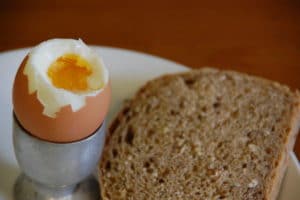
Where is `plate`? This screenshot has height=200, width=300. plate is located at coordinates (126, 80).